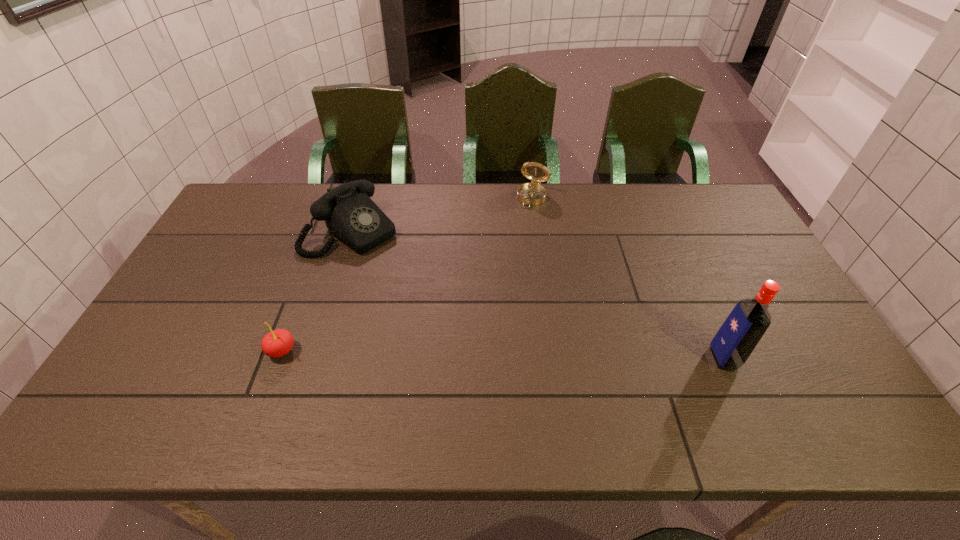
Find the location of a particular element. vacant area at the right edge of the desktop is located at coordinates (725, 237).

In the image, there is a desktop. In order to click on free space at the far left corner in this screenshot , I will do `click(285, 184)`.

You are a GUI agent. You are given a task and a screenshot of the screen. Output one action in this format:
    pyautogui.click(x=<x>, y=<y>)
    Task: Click on the free space at the near left corner of the desktop
    
    Given the screenshot: What is the action you would take?
    pyautogui.click(x=125, y=383)

Locate an element on the screen. vacant space at the far right corner is located at coordinates (693, 189).

Image resolution: width=960 pixels, height=540 pixels. I want to click on vacant area between the cherry and the compass, so click(407, 274).

I want to click on vacant area that lies between the cherry and the compass, so click(x=407, y=274).

Locate an element on the screen. free point between the tallest object and the cherry is located at coordinates (503, 354).

This screenshot has width=960, height=540. Identify the location of free area in between the compass and the cherry. (407, 274).

Where is `free space between the telephone and the cherry`? This screenshot has height=540, width=960. free space between the telephone and the cherry is located at coordinates (316, 291).

You are a GUI agent. You are given a task and a screenshot of the screen. Output one action in this format:
    pyautogui.click(x=<x>, y=<y>)
    Task: Click on the vacant space in between the third object from left to right and the vodka
    The image size is (960, 540).
    Given the screenshot: What is the action you would take?
    pyautogui.click(x=628, y=278)